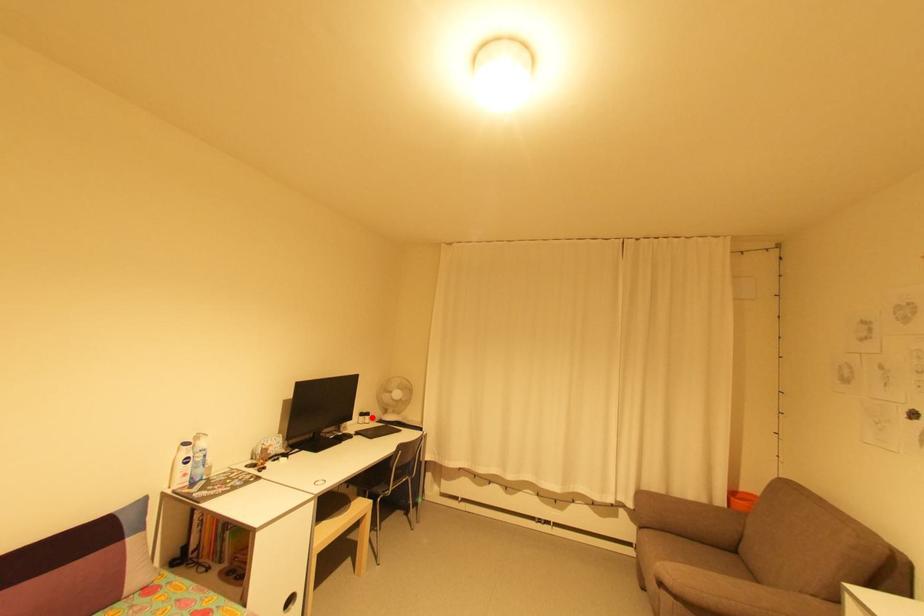
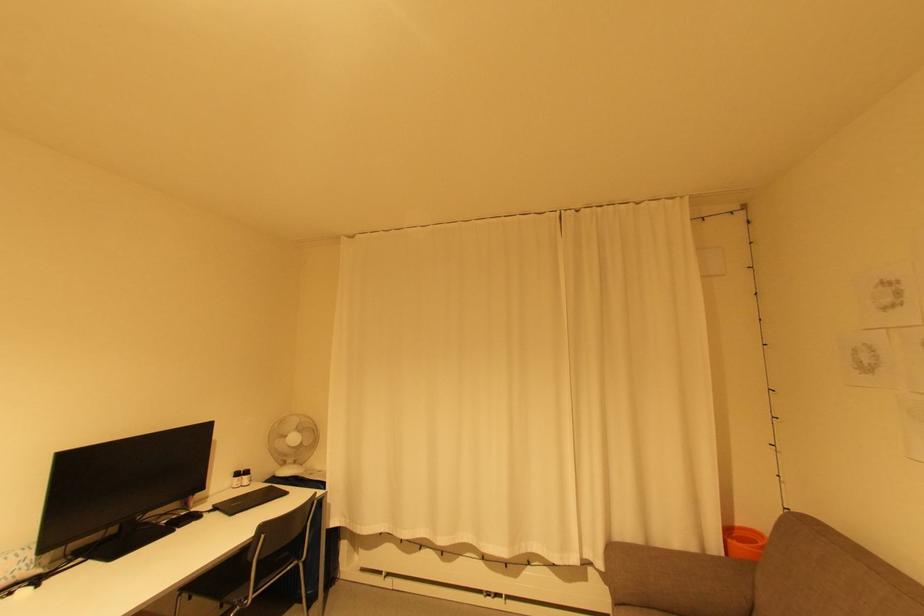
Question: I am providing you with two images of the same scene from different viewpoints. Given a red point in image1, look at the same physical point in image2. Is it:

Choices:
 (A) Closer to the viewpoint
 (B) Farther from the viewpoint

Answer: (A)